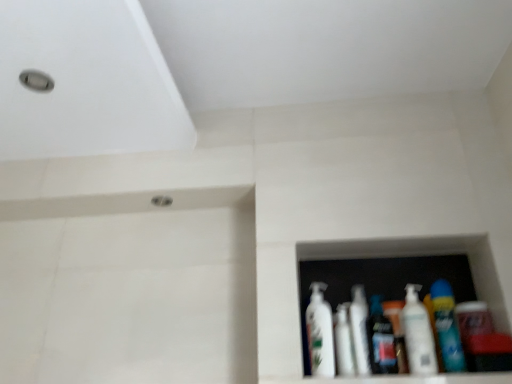
Question: Does white glossy lotion at center, placed as the 1th toiletry when sorted from left to right, have a smaller size compared to white glossy bottle at center, which is the second mouthwash in right-to-left order?

Choices:
 (A) yes
 (B) no

Answer: (B)

Question: Is white glossy lotion at center, placed as the 1th toiletry when sorted from left to right, beside white glossy bottle at center, which appears as the first mouthwash when viewed from the left?

Choices:
 (A) no
 (B) yes

Answer: (B)

Question: Is white glossy lotion at center, which appears as the 2th toiletry when viewed from the right, at the left side of white glossy bottle at center, which appears as the first mouthwash when viewed from the left?

Choices:
 (A) yes
 (B) no

Answer: (B)

Question: Can you confirm if white glossy lotion at center, placed as the 1th toiletry when sorted from left to right, is shorter than white glossy bottle at center, which is the second mouthwash in right-to-left order?

Choices:
 (A) yes
 (B) no

Answer: (B)

Question: From a real-world perspective, is white glossy lotion at center, which appears as the 2th toiletry when viewed from the right, positioned over white glossy bottle at center, which is the second mouthwash in right-to-left order, based on gravity?

Choices:
 (A) no
 (B) yes

Answer: (B)

Question: From their relative heights in the image, would you say white glossy mouthwash at center, which is the 1th mouthwash in right-to-left order, is taller or shorter than white glossy bottle at center, which is the second mouthwash in right-to-left order?

Choices:
 (A) tall
 (B) short

Answer: (A)

Question: From a real-world perspective, is white glossy mouthwash at center, acting as the second mouthwash starting from the left, above or below white glossy bottle at center, which is the second mouthwash in right-to-left order?

Choices:
 (A) above
 (B) below

Answer: (B)

Question: In terms of size, does white glossy mouthwash at center, which is the 1th mouthwash in right-to-left order, appear bigger or smaller than white glossy bottle at center, which is the second mouthwash in right-to-left order?

Choices:
 (A) big
 (B) small

Answer: (A)

Question: Does point (364, 364) appear closer or farther from the camera than point (352, 360)?

Choices:
 (A) closer
 (B) farther

Answer: (A)

Question: Is white glossy lotion at center, which appears as the 2th toiletry when viewed from the right, wider or thinner than white glossy bottle at center, the 2th bottle when ordered from right to left?

Choices:
 (A) wide
 (B) thin

Answer: (B)

Question: Would you say white glossy lotion at center, placed as the 1th toiletry when sorted from left to right, is to the left or to the right of white glossy bottle at center, the 2th bottle when ordered from right to left, in the picture?

Choices:
 (A) left
 (B) right

Answer: (A)

Question: Is point (382, 354) positioned closer to the camera than point (425, 326)?

Choices:
 (A) closer
 (B) farther

Answer: (B)

Question: From a real-world perspective, is white glossy lotion at center, placed as the 1th toiletry when sorted from left to right, positioned above or below white glossy bottle at center, the 2th bottle when ordered from right to left?

Choices:
 (A) above
 (B) below

Answer: (B)

Question: Would you say white glossy mouthwash at center, acting as the second mouthwash starting from the left, is inside or outside white glossy bottle at center, acting as the second toiletry starting from the left?

Choices:
 (A) inside
 (B) outside

Answer: (B)

Question: Is white glossy mouthwash at center, which is the 1th mouthwash in right-to-left order, to the left or to the right of white glossy bottle at center, acting as the second toiletry starting from the left, in the image?

Choices:
 (A) right
 (B) left

Answer: (B)